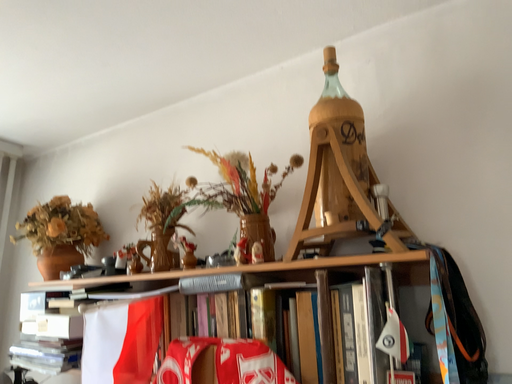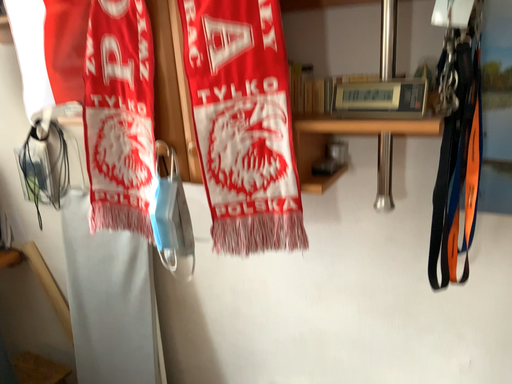
Question: Which way did the camera rotate in the video?

Choices:
 (A) rotated right
 (B) rotated left

Answer: (A)